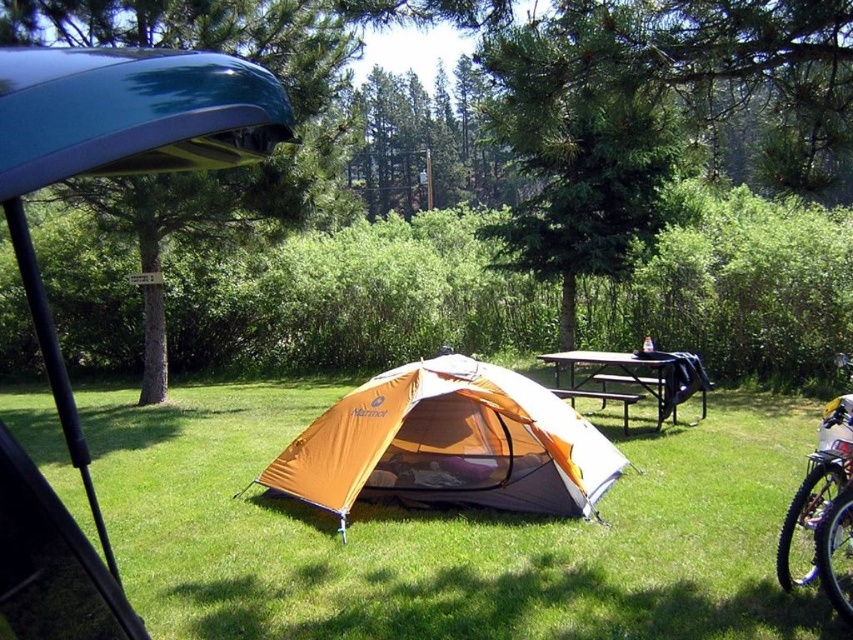
Does orange fabric tent at center have a larger size compared to silver metallic mountain bike at right?

Yes, orange fabric tent at center is bigger than silver metallic mountain bike at right.

Between orange fabric tent at center and silver metallic mountain bike at right, which one appears on the right side from the viewer's perspective?

silver metallic mountain bike at right

Is point (761, 412) farther from camera compared to point (808, 580)?

Yes, point (761, 412) is farther from viewer.

I want to click on orange fabric tent at center, so click(x=448, y=532).

This screenshot has height=640, width=853. Find the location of `green textured tree at left`. green textured tree at left is located at coordinates (210, 35).

Between green textured tree at left and metallic black picnic table at center, which one appears on the right side from the viewer's perspective?

From the viewer's perspective, metallic black picnic table at center appears more on the right side.

At what (x,y) coordinates should I click in order to perform the action: click on green textured tree at left. Please return your answer as a coordinate pair (x, y). This screenshot has height=640, width=853. Looking at the image, I should click on click(x=210, y=35).

Where is `green textured tree at left`? This screenshot has height=640, width=853. green textured tree at left is located at coordinates (210, 35).

Is point (569, 1) farther from viewer compared to point (48, 131)?

Yes, it is.

Find the location of a particular element. This screenshot has width=853, height=640. green leafy tree at center is located at coordinates (582, 144).